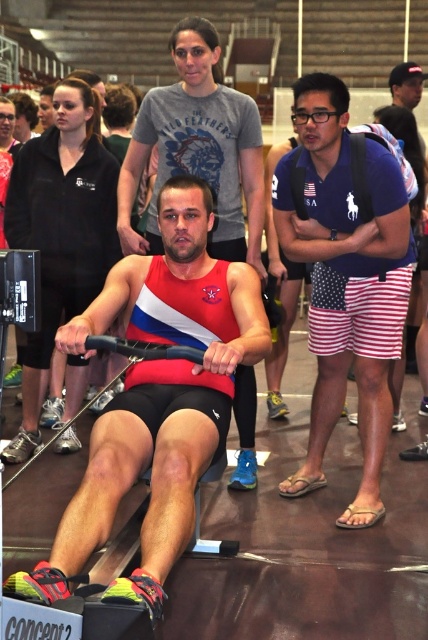
Which is more to the left, red matte tank top at center or blue cotton polo shirt at center?

red matte tank top at center

Between point (171, 449) and point (362, 236), which one is positioned in front?

Point (171, 449) is in front.

Where is `red matte tank top at center`? red matte tank top at center is located at coordinates (157, 397).

Which is behind, point (207, 320) or point (23, 193)?

The point (23, 193) is more distant.

Can you confirm if red matte tank top at center is positioned above matte red tank top at center?

No.

The image size is (428, 640). Find the location of `red matte tank top at center`. red matte tank top at center is located at coordinates (157, 397).

Does blue cotton polo shirt at center lie behind matte red tank top at center?

No, it is in front of matte red tank top at center.

Image resolution: width=428 pixels, height=640 pixels. What do you see at coordinates (345, 280) in the screenshot?
I see `blue cotton polo shirt at center` at bounding box center [345, 280].

Identify the location of blue cotton polo shirt at center. (345, 280).